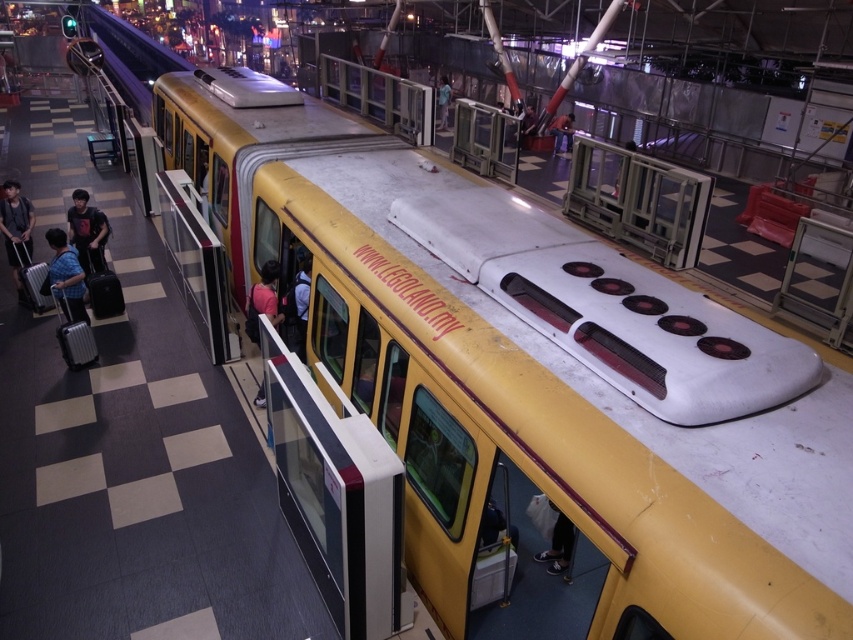
Question: Does matte black suitcase at left appear on the left side of dark gray fabric shirt at left?

Choices:
 (A) no
 (B) yes

Answer: (B)

Question: Does matte blue shirt at left appear on the right side of light blue fabric shirt at center?

Choices:
 (A) yes
 (B) no

Answer: (B)

Question: Which point is farther from the camera taking this photo?

Choices:
 (A) (83, 204)
 (B) (265, 262)
 (C) (21, 218)
 (D) (448, 104)

Answer: (D)

Question: Which point is farther to the camera?

Choices:
 (A) (274, 314)
 (B) (572, 131)
 (C) (560, 536)
 (D) (15, 212)

Answer: (B)

Question: Which point is closer to the camera?

Choices:
 (A) (74, 248)
 (B) (257, 323)

Answer: (B)

Question: Does dark blue jeans at lower center have a lesser width compared to light blue fabric shirt at center?

Choices:
 (A) yes
 (B) no

Answer: (A)